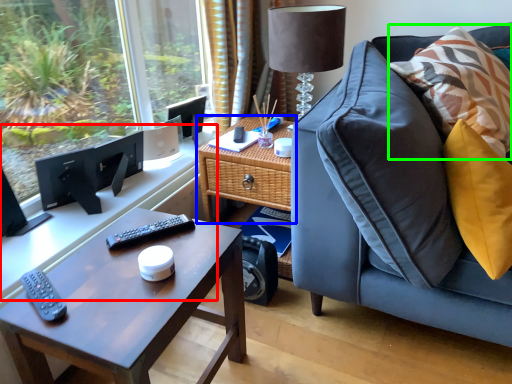
Question: Which is nearer to the computer desk (highlighted by a red box)? table (highlighted by a blue box) or pillow (highlighted by a green box).

Choices:
 (A) table
 (B) pillow

Answer: (A)